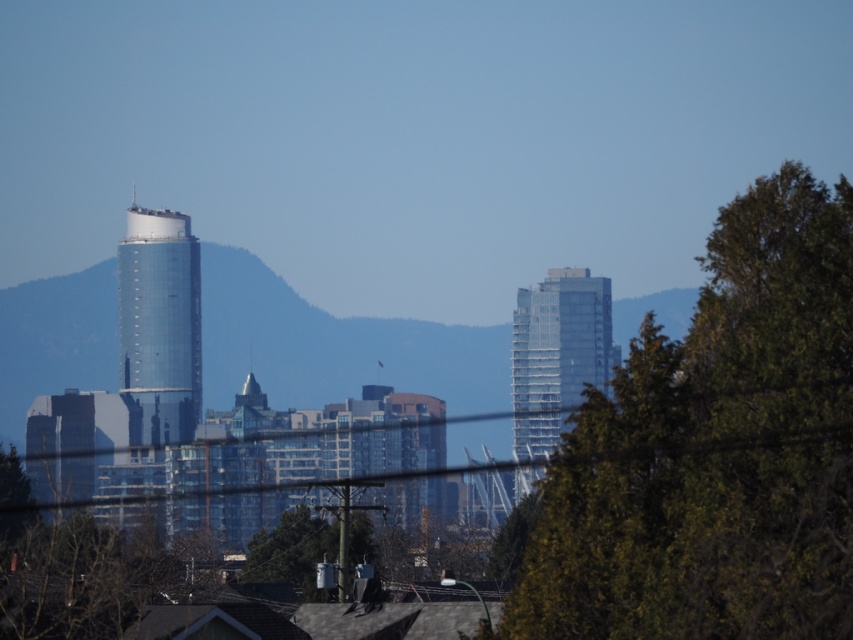
You are an urban planner analyzing the city layout. You observe two points in the scene labeled as point (47, 531) and point (529, 432). Based on their positions, which point is closer to the foreground?

Point (529, 432) is closer to the foreground because it is in front of point (47, 531).

You are a city planner evaluating the urban greenery. You see the green leafy tree at lower left and the green matte tree at center. Which tree has a wider canopy?

The green leafy tree at lower left has a wider canopy than the green matte tree at center.